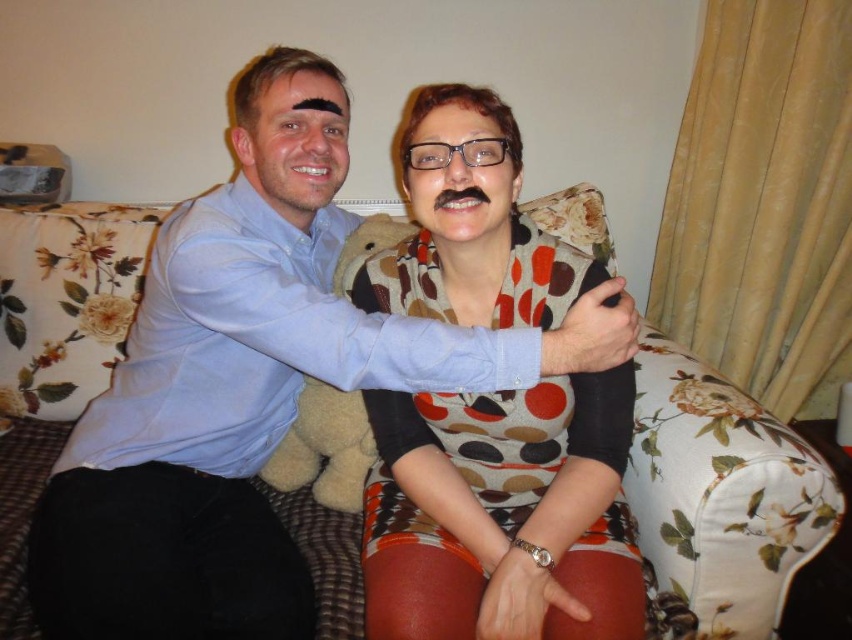
You are a photographer setting up a shoot in the living room. You need to position a large camera on a tripod between the floral fabric couch at center and the polka dot sweater at center so that both are in focus. Which object should the camera be closer to to ensure both are in focus?

The camera should be closer to the polka dot sweater at center because the floral fabric couch at center is further away, so positioning the camera closer to the closer object helps keep both in focus.

You are a photographer who wants to ensure that both the polka dot sweater at center and the fuzzy beige teddy bear at center are clearly visible in the photo. Which object should you focus on first to ensure the other remains in focus?

The polka dot sweater at center is below fuzzy beige teddy bear at center. To ensure both are in focus, you should focus on the fuzzy beige teddy bear at center first since it is closer to the camera, allowing the sweater to stay in focus as well.

You are trying to decide whether to place a new rectangular coffee table in front of the floral fabric couch at center and the polka dot sweater at center. The coffee table must be placed between them. Given their widths, which object should the coffee table be closer to?

The coffee table should be closer to the floral fabric couch at center because its width is narrower than the polka dot sweater at center, so positioning the table closer to the narrower object would allow for better balance and symmetry in the arrangement.